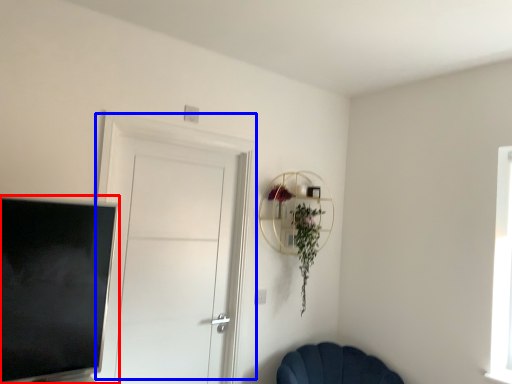
Question: Among these objects, which one is farthest to the camera, television (highlighted by a red box) or door (highlighted by a blue box)?

Choices:
 (A) television
 (B) door

Answer: (B)